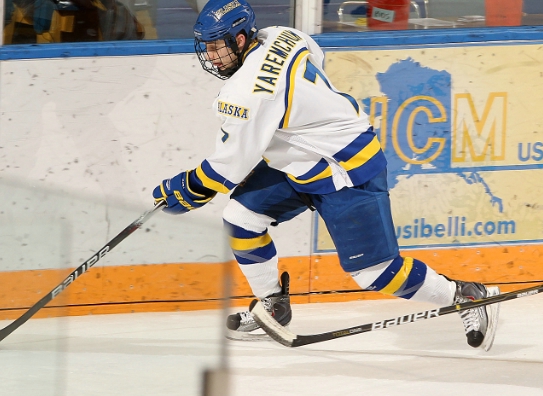
The height and width of the screenshot is (396, 543). In order to click on glass in this screenshot , I will do `click(85, 18)`, `click(394, 41)`, `click(394, 12)`.